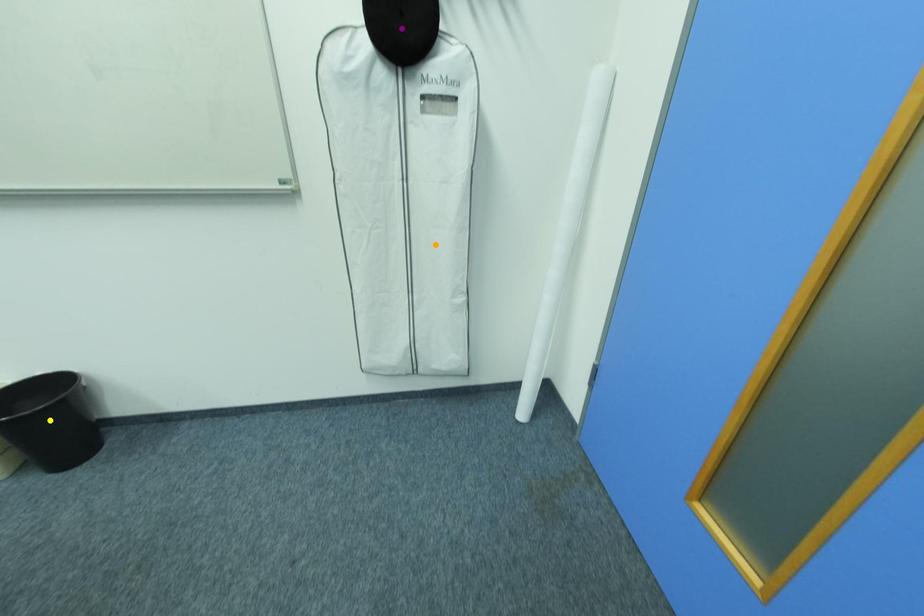
Order these from nearest to farthest:
purple point
yellow point
orange point

purple point < yellow point < orange point